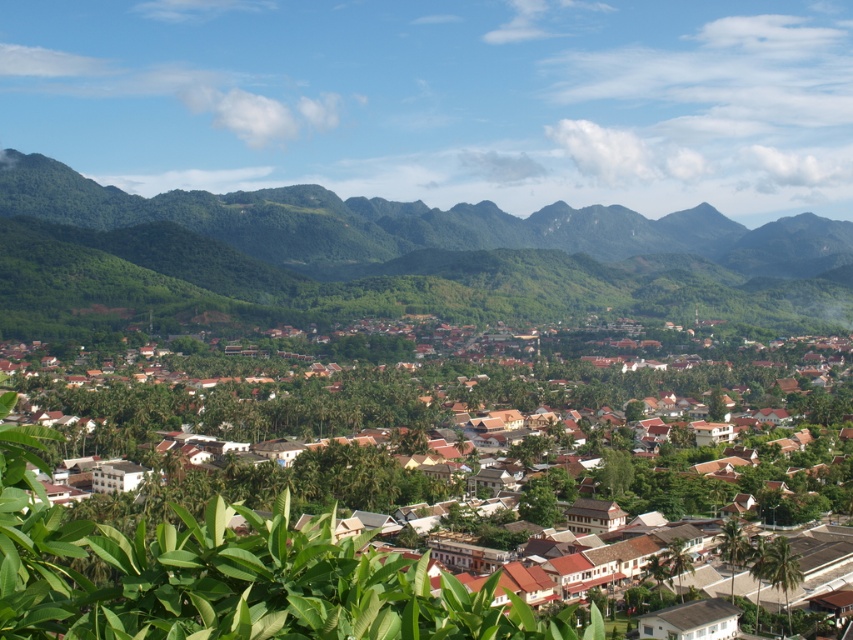
Between green forested mountain at upper center and brown wooden houses at center, which one has less height?

With less height is brown wooden houses at center.

Between point (802, 218) and point (827, 486), which one is positioned behind?

The point (802, 218) is more distant.

Locate an element on the screen. This screenshot has height=640, width=853. green forested mountain at upper center is located at coordinates (398, 256).